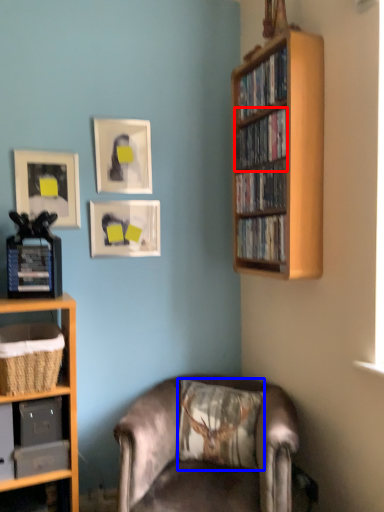
Question: Which point is closer to the camera, book (highlighted by a red box) or pillow (highlighted by a blue box)?

Choices:
 (A) book
 (B) pillow

Answer: (A)